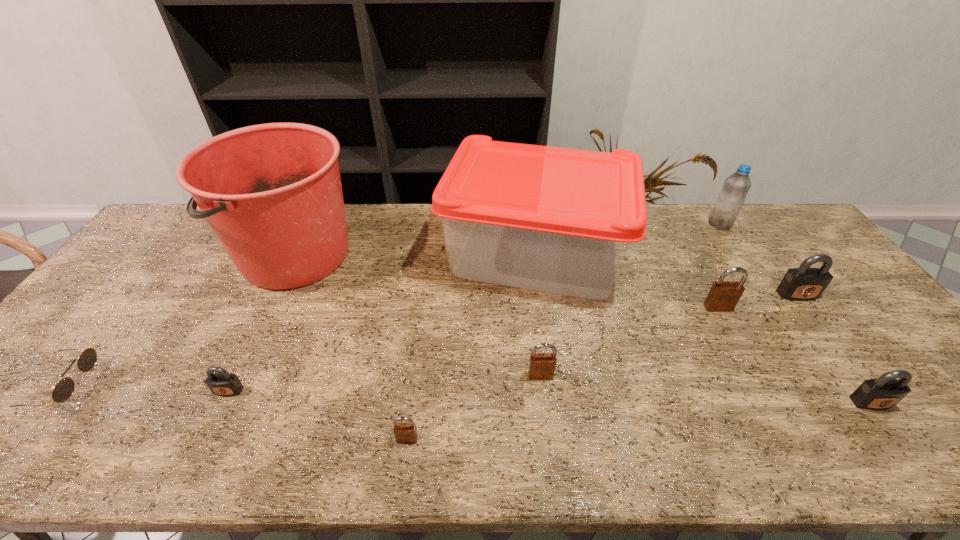
Locate an element on the screen. The height and width of the screenshot is (540, 960). vacant space in between the water bottle and the second smallest gray padlock is located at coordinates [796, 313].

Image resolution: width=960 pixels, height=540 pixels. In order to click on vacant space that is in between the nearest object and the tallest object in this screenshot , I will do `click(351, 347)`.

At what (x,y) coordinates should I click in order to perform the action: click on empty space that is in between the ninth shortest object and the bucket. Please return your answer as a coordinate pair (x, y). Looking at the image, I should click on (415, 254).

The image size is (960, 540). What are the coordinates of `vacant space in between the leftmost object and the tallest object` in the screenshot? It's located at (178, 321).

Where is `vacant space that's between the water bottle and the farthest brown padlock`? The image size is (960, 540). vacant space that's between the water bottle and the farthest brown padlock is located at coordinates (719, 266).

The height and width of the screenshot is (540, 960). What are the coordinates of `vacant point located between the tallest object and the leftmost gray padlock` in the screenshot? It's located at (262, 322).

Identify which object is located as the third nearest to the second brown padlock from right to left. Please provide its 2D coordinates. Your answer should be formatted as a tuple, i.e. [(x, y)], where the tuple contains the x and y coordinates of a point satisfying the conditions above.

[(723, 296)]

What are the coordinates of `the third closest object relative to the tallest object` in the screenshot? It's located at (221, 383).

Where is `the closest padlock relative to the leftmost padlock`? This screenshot has height=540, width=960. the closest padlock relative to the leftmost padlock is located at coordinates (405, 433).

Identify which padlock is the nearest to the tray. Please provide its 2D coordinates. Your answer should be formatted as a tuple, i.e. [(x, y)], where the tuple contains the x and y coordinates of a point satisfying the conditions above.

[(723, 296)]